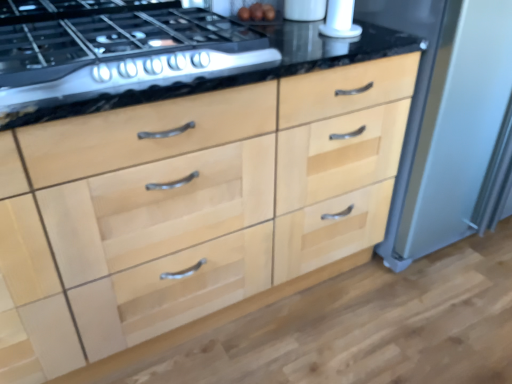
Where is `vacant space situated above satin black gas stove at upper left (from a real-world perspective)`? vacant space situated above satin black gas stove at upper left (from a real-world perspective) is located at coordinates (117, 20).